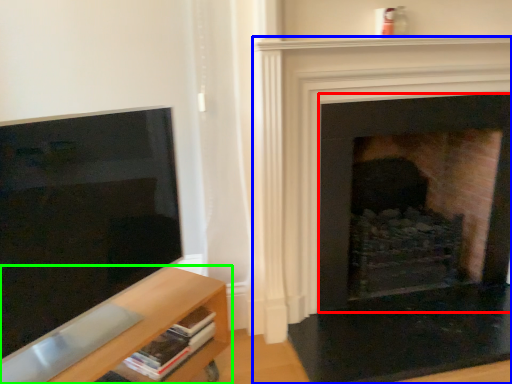
Question: Which is farther away from fireplace (highlighted by a red box)? fireplace (highlighted by a blue box) or shelf (highlighted by a green box)?

Choices:
 (A) fireplace
 (B) shelf

Answer: (B)